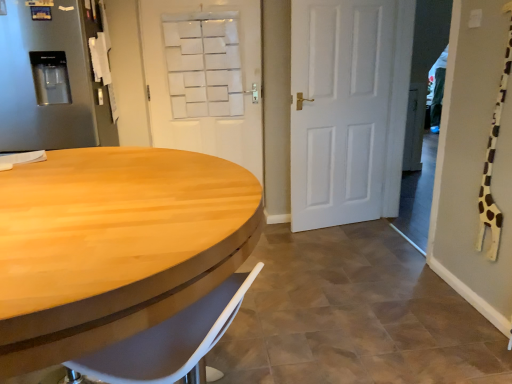
You are a GUI agent. You are given a task and a screenshot of the screen. Output one action in this format:
    pyautogui.click(x=<x>, y=<y>)
    Task: Click on the vacant area situated below white matte door at center, placed as the second door when sorted from left to right (from a real-world perspective)
    The image size is (512, 384).
    Given the screenshot: What is the action you would take?
    [x=333, y=227]